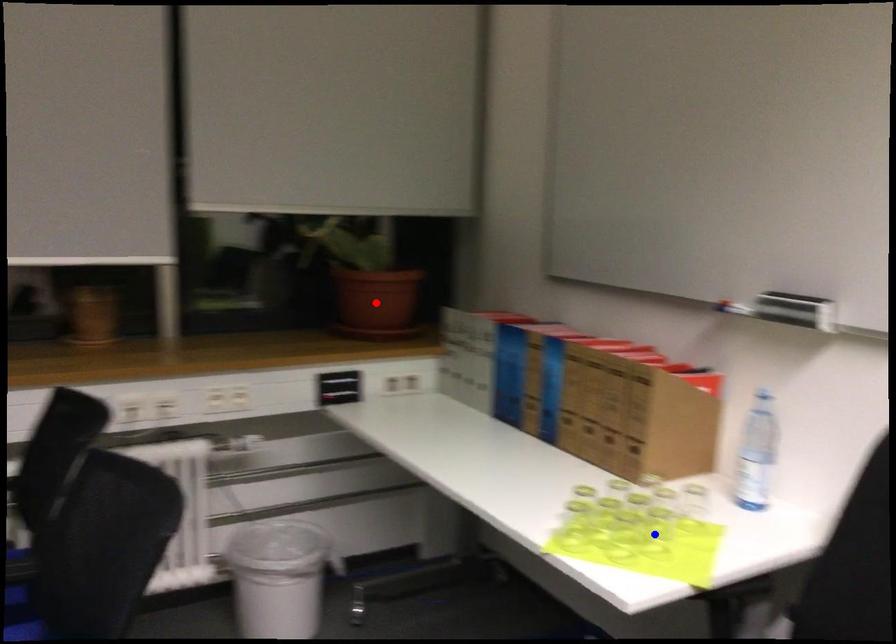
Question: In the image, two points are highlighted. Which point is nearer to the camera? Reply with the corresponding letter.

Choices:
 (A) blue point
 (B) red point

Answer: (A)